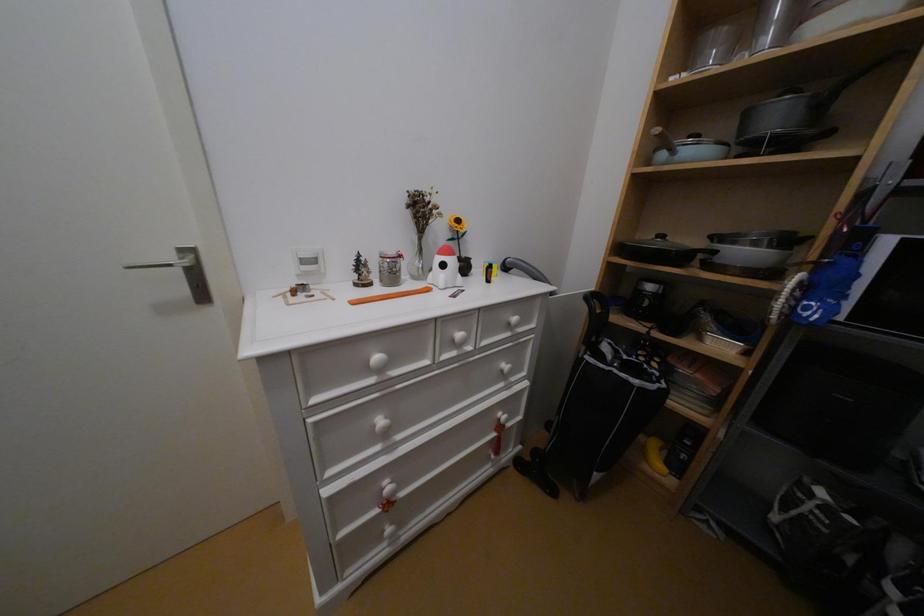
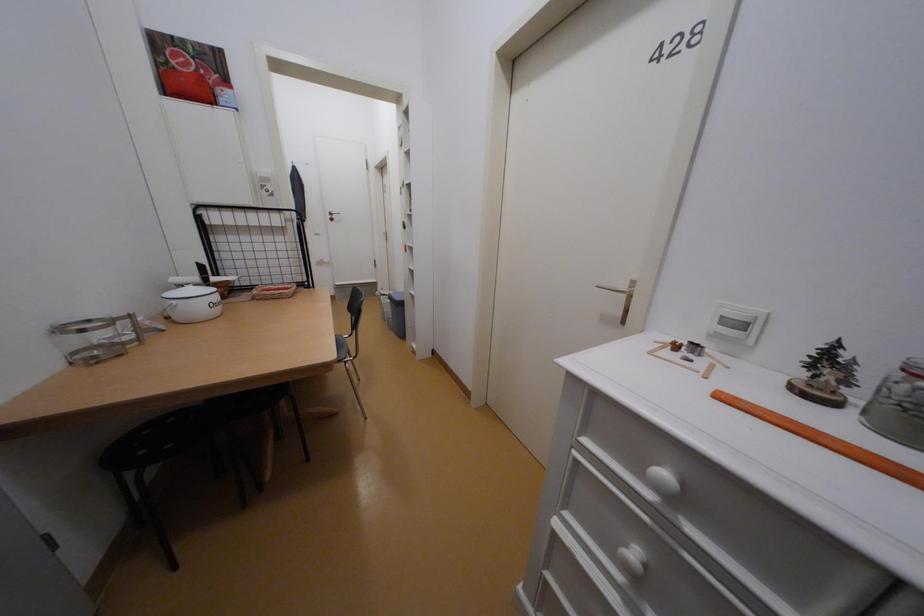
Based on the continuous images, in which direction is the camera rotating?

The camera rotated toward left-down.